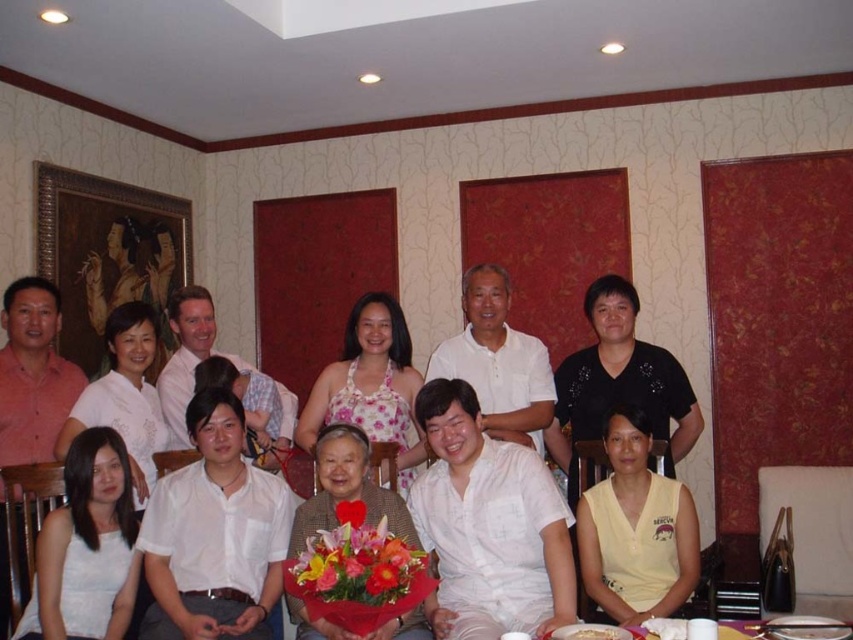
You are a photographer at this event and need to ensure both the white cotton shirt at center and the yellow cotton blouse at lower center are visible in your photo. Given their sizes, which one might you need to adjust your camera angle to better capture?

The white cotton shirt at center is larger in size compared to the yellow cotton blouse at lower center, so you might need to adjust your camera angle to ensure the larger white cotton shirt at center does not overshadow the smaller yellow cotton blouse at lower center in the photo.

You are a photographer positioned at the entrance of the room. You need to capture a photo that includes both the white satin dress at lower left and the white paper plate at lower center. Based on their positions, which object should you ensure is placed on the left side of the photo frame?

The white satin dress at lower left is to the left of the white paper plate at lower center, so you should ensure the white satin dress at lower left is on the left side of the photo frame to include both in the shot.